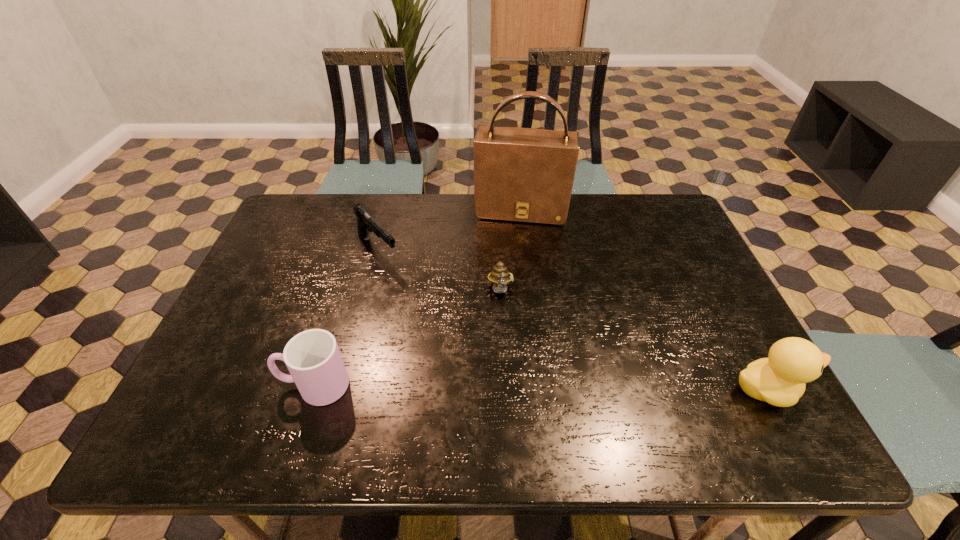
At what (x,y) coordinates should I click in order to perform the action: click on cup present at the near edge. Please return your answer as a coordinate pair (x, y). The image size is (960, 540). Looking at the image, I should click on (312, 357).

The image size is (960, 540). I want to click on duck that is at the near edge, so click(x=780, y=380).

Image resolution: width=960 pixels, height=540 pixels. What are the coordinates of `object at the right edge` in the screenshot? It's located at (780, 380).

Where is `object situated at the near right corner`? The height and width of the screenshot is (540, 960). object situated at the near right corner is located at coordinates pos(780,380).

Image resolution: width=960 pixels, height=540 pixels. In the image, there is a desktop. Find the location of `vacant space at the far edge`. vacant space at the far edge is located at coordinates (447, 225).

In order to click on vacant space at the near edge in this screenshot , I will do `click(646, 382)`.

Image resolution: width=960 pixels, height=540 pixels. I want to click on vacant space at the right edge of the desktop, so click(659, 274).

The height and width of the screenshot is (540, 960). What are the coordinates of `free space at the far left corner` in the screenshot? It's located at (330, 207).

This screenshot has height=540, width=960. Find the location of `vacant region at the far right corner`. vacant region at the far right corner is located at coordinates (665, 235).

This screenshot has width=960, height=540. In the image, there is a desktop. What are the coordinates of `vacant region at the near right corner` in the screenshot? It's located at (712, 377).